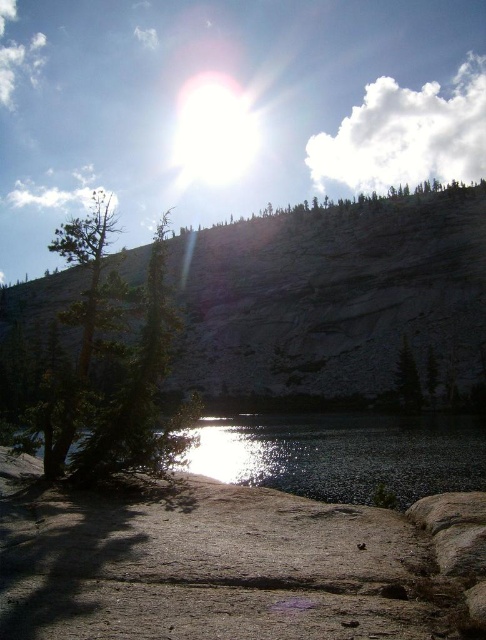
Can you confirm if green matte tree at lower left is smaller than green matte tree at left?

Yes, green matte tree at lower left is smaller than green matte tree at left.

Is green matte tree at lower left thinner than green matte tree at left?

Yes, green matte tree at lower left is thinner than green matte tree at left.

Describe the element at coordinates (109, 362) in the screenshot. I see `green matte tree at lower left` at that location.

Identify the location of green matte tree at lower left. The image size is (486, 640). (109, 362).

Consider the image. Does smooth gray water at lower left have a greater width compared to green matte tree at left?

No.

The image size is (486, 640). Find the location of `smooth gray water at lower left`. smooth gray water at lower left is located at coordinates (344, 454).

Between point (84, 349) and point (415, 410), which one is positioned in front?

Point (84, 349) is in front.

Identify the location of green matte tree at left. (87, 259).

Who is more distant from viewer, (73, 230) or (413, 403)?

Positioned behind is point (413, 403).

Image resolution: width=486 pixels, height=640 pixels. Find the location of `green matte tree at left`. green matte tree at left is located at coordinates (87, 259).